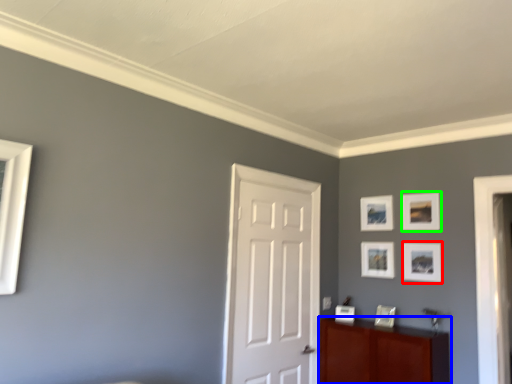
Question: Which is nearer to the picture frame (highlighted by a red box)? cabinetry (highlighted by a blue box) or picture frame (highlighted by a green box).

Choices:
 (A) cabinetry
 (B) picture frame

Answer: (B)